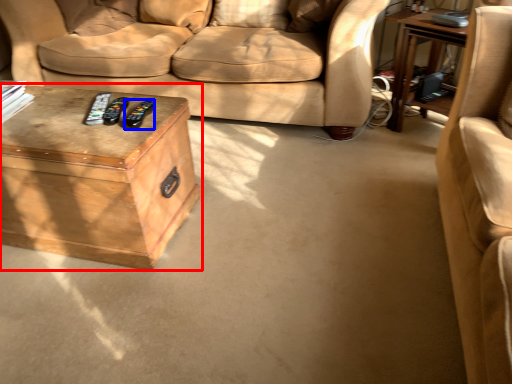
Question: Which of the following is the closest to the observer, table (highlighted by a red box) or remote (highlighted by a blue box)?

Choices:
 (A) table
 (B) remote

Answer: (A)